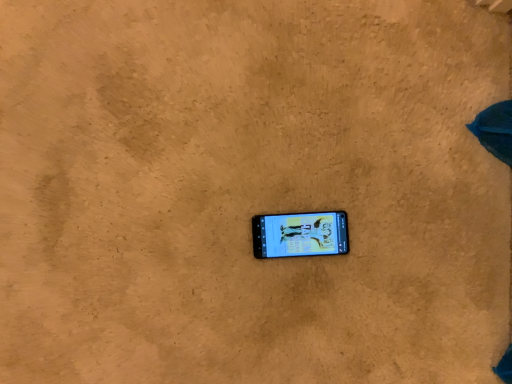
Describe the element at coordinates (300, 234) in the screenshot. The width and height of the screenshot is (512, 384). I see `shiny black phone at center` at that location.

This screenshot has width=512, height=384. Find the location of `shiny black phone at center`. shiny black phone at center is located at coordinates (300, 234).

Where is `shiny black phone at center`? shiny black phone at center is located at coordinates (300, 234).